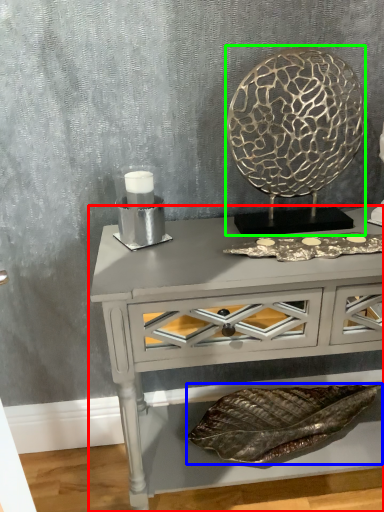
Question: Which object is the farthest from table (highlighted by a red box)? Choose among these: material (highlighted by a blue box) or round table (highlighted by a green box).

Choices:
 (A) material
 (B) round table

Answer: (A)